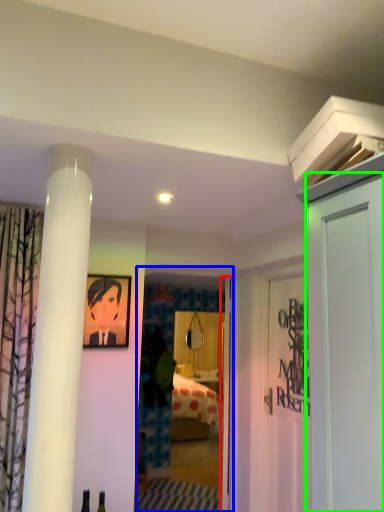
Question: Estimate the real-world distances between objects in this image. Which object is closer to door (highlighted by a red box), glass door (highlighted by a blue box) or door (highlighted by a green box)?

Choices:
 (A) glass door
 (B) door

Answer: (A)